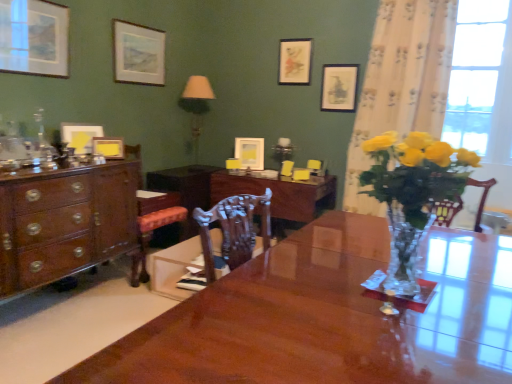
Image resolution: width=512 pixels, height=384 pixels. I want to click on spots to the right of translucent glass vase at center, so click(476, 285).